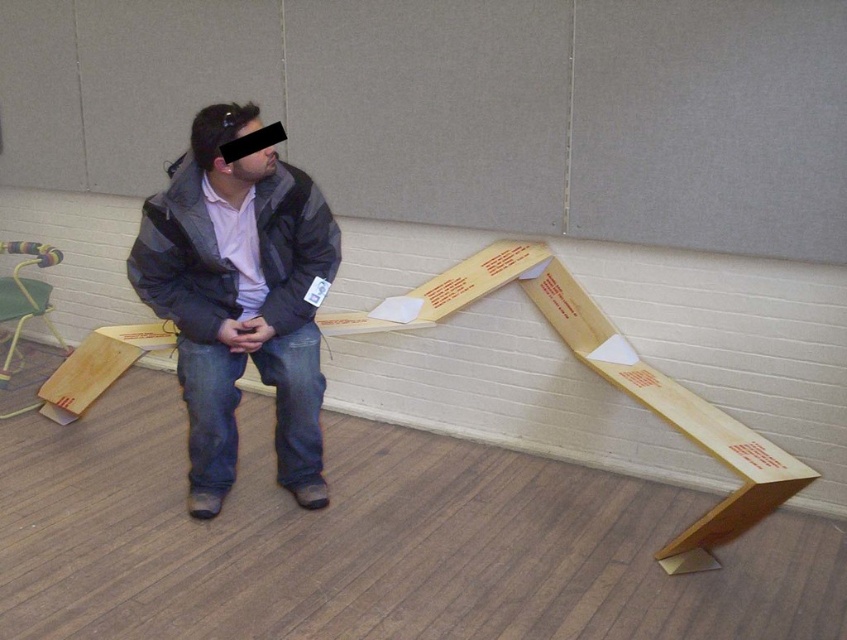
You are organizing a small event and need to arrange seating. You have a striped fabric jacket at center and a multicolored plastic stool at left. Which object is positioned to the left of the other?

The striped fabric jacket at center is to the right of the multicolored plastic stool at left, so the multicolored plastic stool at left is positioned to the left of the striped fabric jacket at center.

You are a delivery person who needs to place a package between the dark gray jacket at center and the multicolored plastic stool at left. The package is 1.5 meters long. Can you fit the package between them without moving either object?

The distance between the dark gray jacket at center and the multicolored plastic stool at left is 1.63 meters. Since the package is 1.5 meters long, it can fit between them as there is enough space.

You are standing at the origin of a coordinate system in the image. You want to move towards the point labeled point (264,228). However, there is an obstacle at point (176,198). Will you collide with the obstacle before reaching your destination?

Since point (264,228) is behind point (176,198), moving towards point (264,228) would mean the obstacle at point (176,198) is in front of the destination. Therefore, you would collide with the obstacle before reaching the destination.